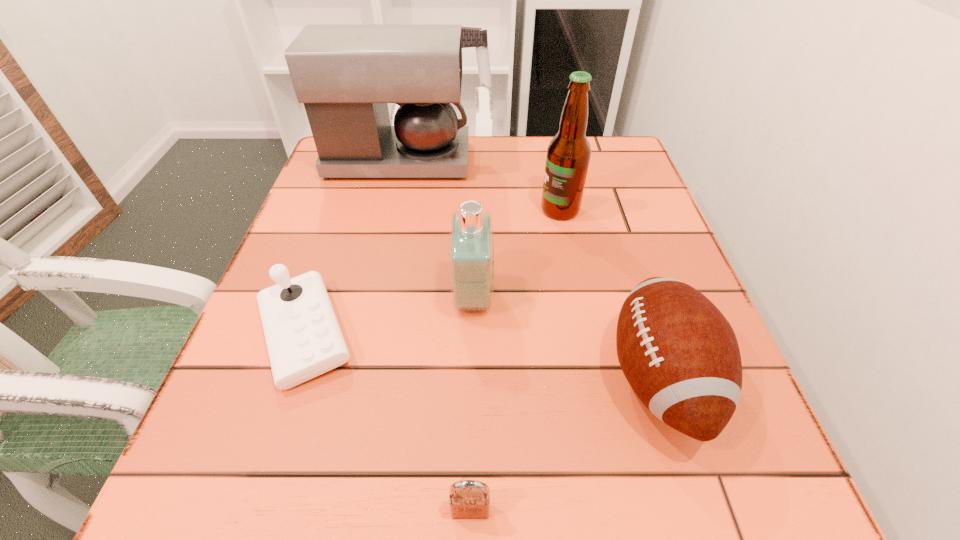
Image resolution: width=960 pixels, height=540 pixels. Identify the location of beer bottle. (568, 154).

What are the coordinates of `the farthest object` in the screenshot? It's located at (345, 75).

At what (x,y) coordinates should I click in order to perform the action: click on perfume. Please return your answer as a coordinate pair (x, y). This screenshot has width=960, height=540. Looking at the image, I should click on (471, 239).

Locate an element on the screen. The image size is (960, 540). the fourth tallest object is located at coordinates (680, 355).

At what (x,y) coordinates should I click in order to perform the action: click on joystick. Please return your answer as a coordinate pair (x, y). This screenshot has width=960, height=540. Looking at the image, I should click on (304, 340).

Locate an element on the screen. the nearest object is located at coordinates (469, 499).

Find the location of a particular element. This screenshot has width=960, height=540. vacant space located 0.050m on the label of the second farthest object is located at coordinates (517, 210).

Locate an element on the screen. This screenshot has height=540, width=960. vacant space situated 0.150m on the label of the second farthest object is located at coordinates (472, 210).

Locate an element on the screen. The height and width of the screenshot is (540, 960). vacant space located on the label of the second farthest object is located at coordinates (436, 210).

At what (x,y) coordinates should I click in order to perform the action: click on free space located 0.060m on the carafe side of the farthest object. Please return your answer as a coordinate pair (x, y). Image resolution: width=960 pixels, height=540 pixels. Looking at the image, I should click on (492, 161).